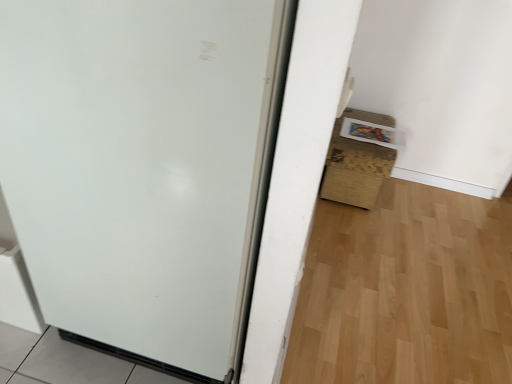
Image resolution: width=512 pixels, height=384 pixels. In order to click on free location to the right of brown cardboard box at lower right in this screenshot , I will do `click(410, 205)`.